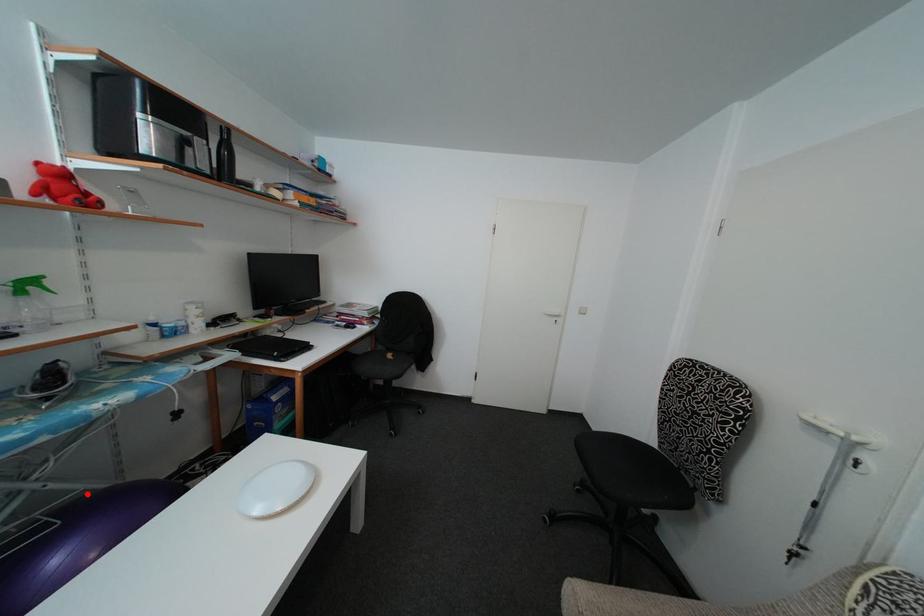
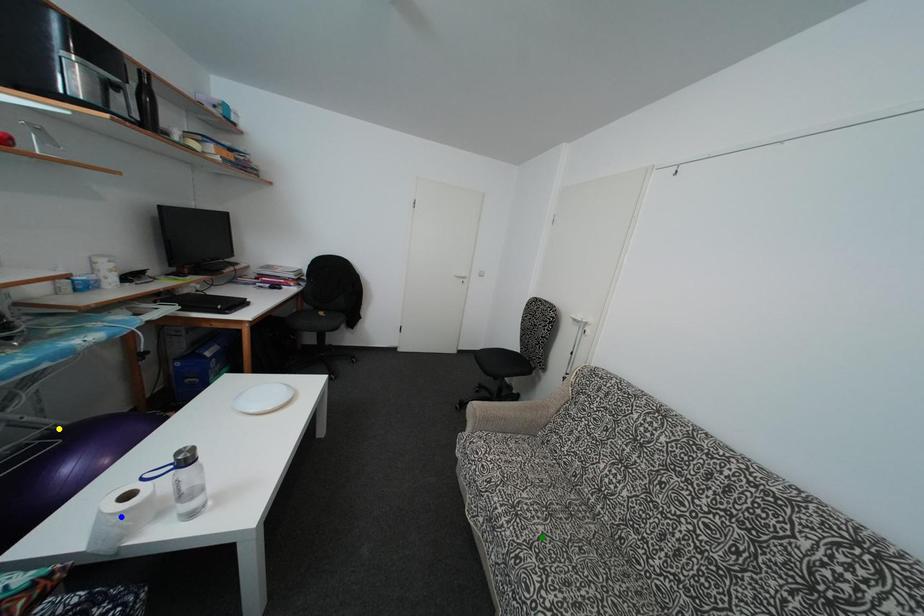
Question: I am providing you with two images of the same scene from different viewpoints. A red point is marked on the first image. You are given multiple points on the second image. Which mark in image 2 goes with the point in image 1?

Choices:
 (A) green point
 (B) blue point
 (C) yellow point

Answer: (C)